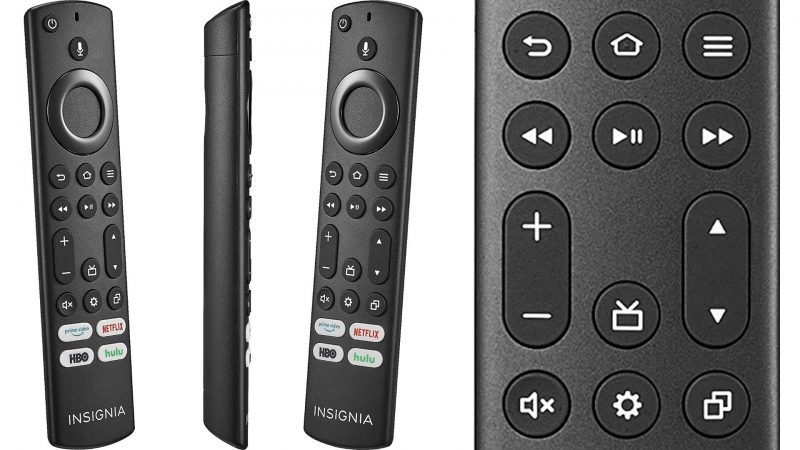
At what (x,y) coordinates should I click in order to perform the action: click on remote control. Please return your answer as a coordinate pair (x, y). Image resolution: width=800 pixels, height=450 pixels. Looking at the image, I should click on (529, 184), (340, 138), (210, 114), (77, 104).